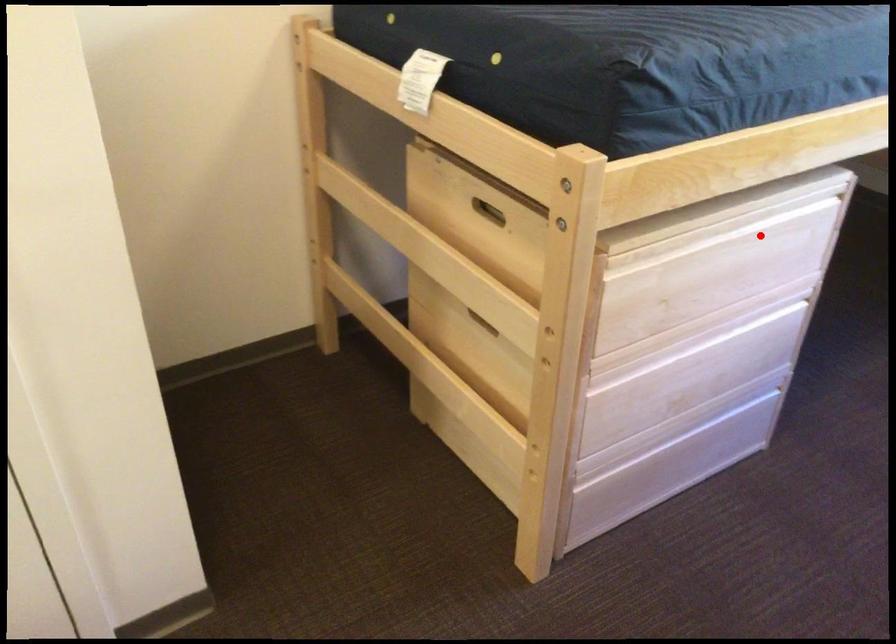
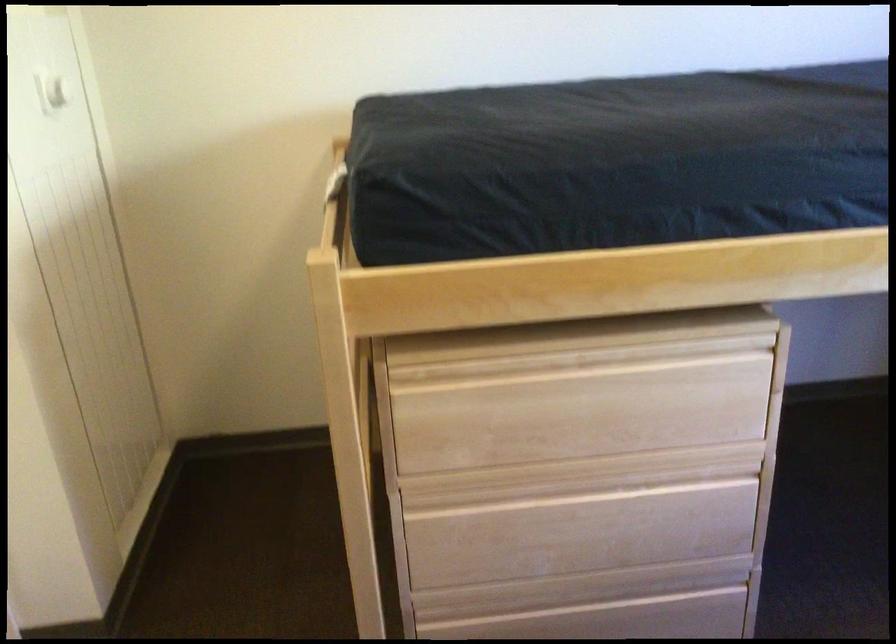
In the second image, find the point that corresponds to the highlighted location in the first image.

(642, 377)